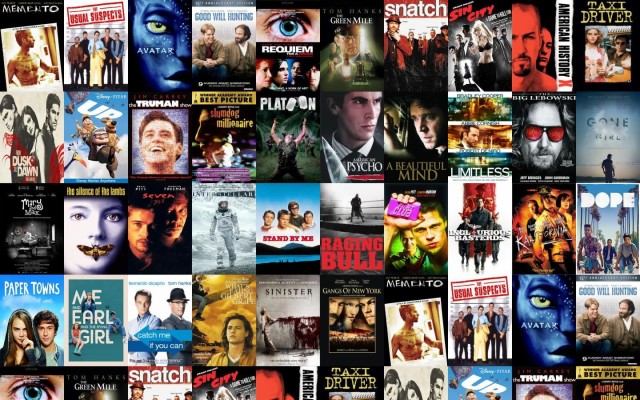
The width and height of the screenshot is (640, 400). In order to click on movie posters cut off in this screenshot , I will do `click(41, 385)`, `click(92, 387)`, `click(166, 381)`, `click(223, 384)`, `click(284, 384)`, `click(362, 382)`, `click(408, 381)`, `click(479, 382)`, `click(547, 388)`, `click(609, 383)`.